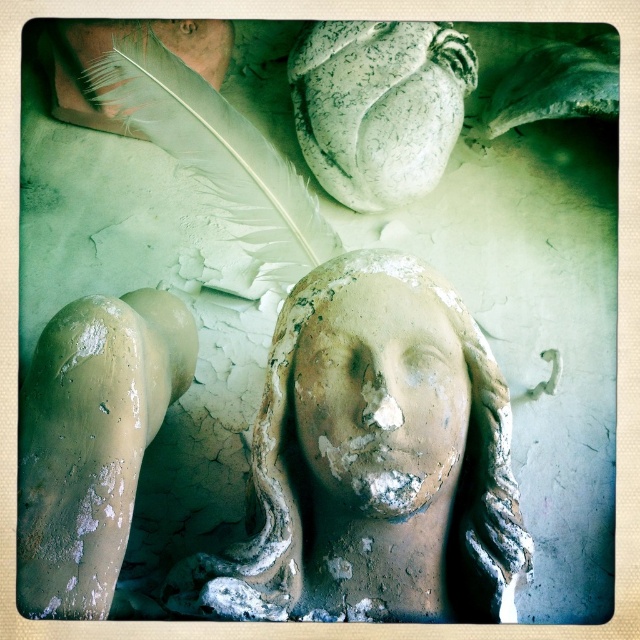
Looking at the sculpture in the image, which object, the matte clay head at center or the matte clay face at center, is taller?

The matte clay head at center is taller than the matte clay face at center.

You are an archaeologist examining the sculpture. You notice a point marked at coordinates (372, 461). What does this point indicate on the sculpture?

The point at coordinates (372, 461) indicates the location of the matte clay head at center.

You are an archaeologist examining the sculpture. You notice two parts labeled as the matte clay head at center and the matte clay face at center. Which part is closer to the large feather in the background?

The matte clay face at center is closer to the large feather in the background because the matte clay head at center is 1.32 inches away from it, implying the face is part of the head and positioned closer to the feather.